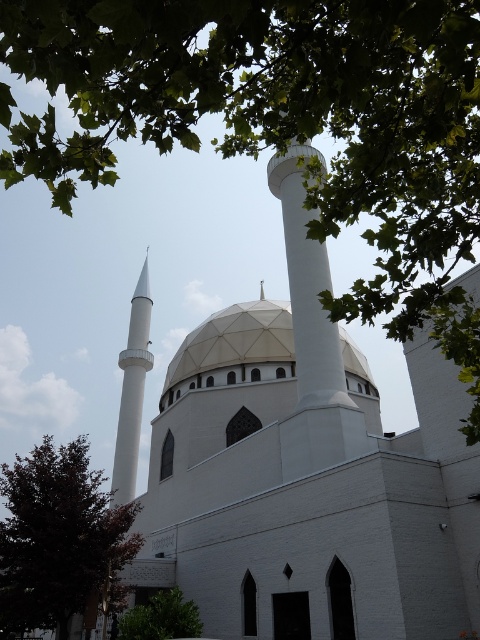
Question: Does white textured dome at center come in front of green leafy tree at lower left?

Choices:
 (A) no
 (B) yes

Answer: (A)

Question: Which point is farther to the camera?

Choices:
 (A) [x=187, y=113]
 (B) [x=190, y=627]
 (C) [x=313, y=362]

Answer: (C)

Question: Considering the real-world distances, which object is closest to the dark brown wood tree at lower left?

Choices:
 (A) white smooth minaret at left
 (B) white textured dome at center
 (C) green leafy tree at upper center

Answer: (B)

Question: Among these objects, which one is nearest to the camera?

Choices:
 (A) white smooth minaret at center
 (B) white smooth minaret at left
 (C) green leafy tree at lower left
 (D) green leafy tree at upper center

Answer: (D)

Question: Can you confirm if green leafy tree at upper center is positioned below white textured dome at center?

Choices:
 (A) no
 (B) yes

Answer: (A)

Question: Is the position of dark brown wood tree at lower left less distant than that of white smooth minaret at left?

Choices:
 (A) no
 (B) yes

Answer: (B)